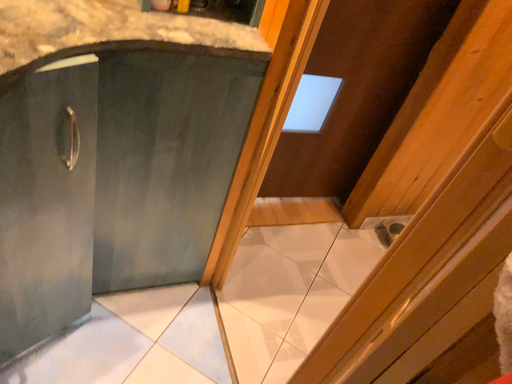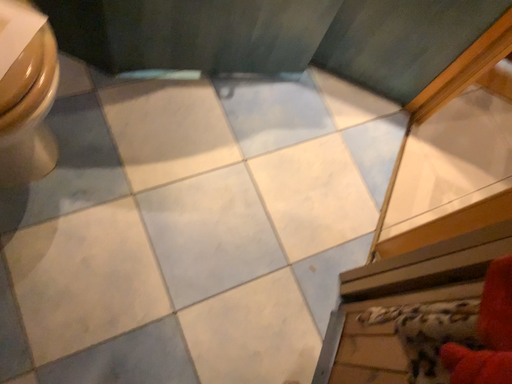
Question: Which way did the camera rotate in the video?

Choices:
 (A) rotated downward
 (B) rotated upward

Answer: (A)